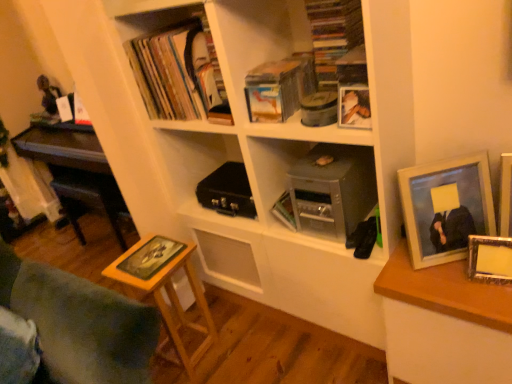
Question: Based on their positions, is matte black book at upper left, the third book ordered from the bottom, located to the left or right of wooden photo frame at right, positioned as the second picture frame in right-to-left order?

Choices:
 (A) right
 (B) left

Answer: (B)

Question: Is matte black book at upper left, positioned as the 1th book in top-to-bottom order, inside the boundaries of wooden photo frame at right, which ranks as the third picture frame in left-to-right order, or outside?

Choices:
 (A) inside
 (B) outside

Answer: (B)

Question: Which object is the farthest from the metallic gray briefcase at center?

Choices:
 (A) yellow matte board game at lower left, placed as the first book when sorted from left to right
 (B) matte silver picture frame at right, the fourth picture frame viewed from the left
 (C) black matte briefcase at center
 (D) white matte bookcase at center
 (E) metallic silver book at center, the second book when ordered from bottom to top

Answer: (A)

Question: Which of these objects is positioned farthest from the wooden photo frame at right, positioned as the second picture frame in right-to-left order?

Choices:
 (A) matte silver photo frame at upper right, which is the 4th picture frame from right to left
 (B) yellow matte board game at lower left, placed as the first book when sorted from bottom to top
 (C) matte silver picture frame at right, the fourth picture frame viewed from the left
 (D) metallic gray briefcase at center
 (E) matte black book at upper left, acting as the 2th book starting from the right

Answer: (E)